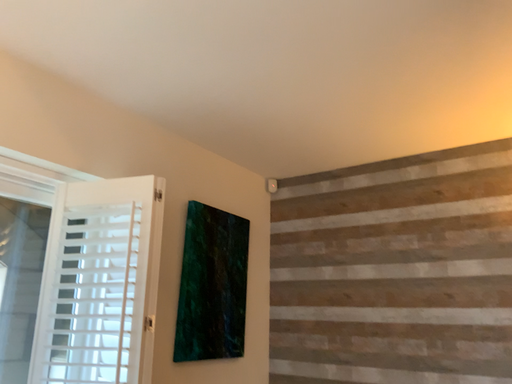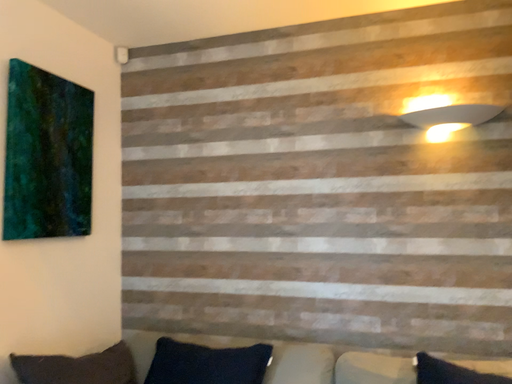
Question: Which way did the camera rotate in the video?

Choices:
 (A) rotated left
 (B) rotated right

Answer: (B)